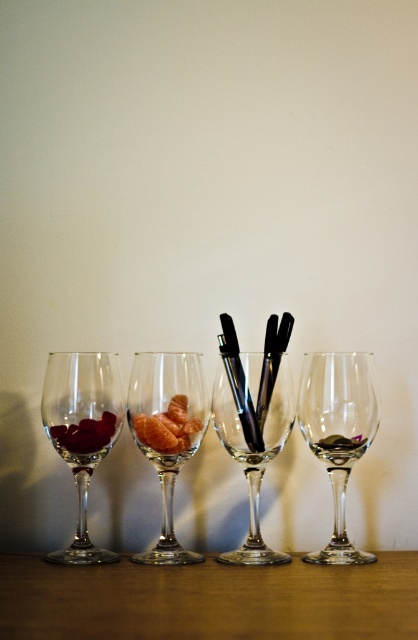
Which object is located at the coordinates point (254, 452)?

The transparent glass pens at center is located at point (254, 452).

You are a guest at a party and see the shiny red grapes at left and the transparent glass at center on the table. Which one is closer to the left edge of the table?

The shiny red grapes at left are closer to the left edge of the table since they are positioned to the left of the transparent glass at center.